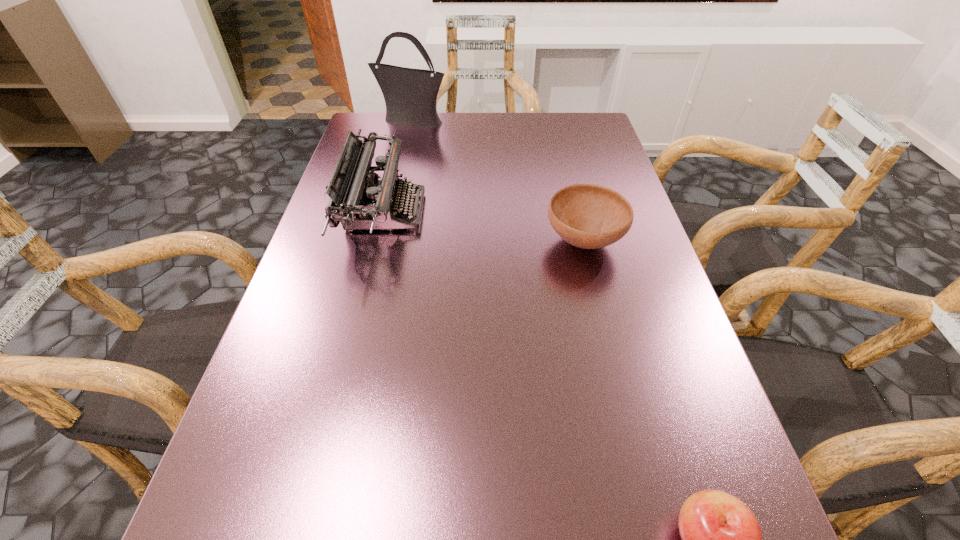
Locate an element on the screen. The width and height of the screenshot is (960, 540). object that is at the right edge is located at coordinates (588, 216).

The height and width of the screenshot is (540, 960). Identify the location of object that is at the far left corner. (410, 95).

The width and height of the screenshot is (960, 540). What are the coordinates of `vacant space at the far edge of the desktop` in the screenshot? It's located at (445, 118).

Find the location of a particular element. The height and width of the screenshot is (540, 960). vacant area at the left edge of the desktop is located at coordinates pos(277,340).

Find the location of a particular element. free space at the right edge of the desktop is located at coordinates pos(663,393).

Locate an element on the screen. The height and width of the screenshot is (540, 960). vacant area at the far left corner is located at coordinates (380, 147).

The height and width of the screenshot is (540, 960). Find the location of `free space between the second tallest object and the tallest object`. free space between the second tallest object and the tallest object is located at coordinates (398, 166).

What are the coordinates of `free area in between the bowl and the typewriter` in the screenshot? It's located at (485, 226).

Identify the location of free space that is in between the shoulder bag and the third shortest object. (398, 166).

At what (x,y) coordinates should I click in order to perform the action: click on vacant space in between the second tallest object and the farthest object. Please return your answer as a coordinate pair (x, y). Image resolution: width=960 pixels, height=540 pixels. Looking at the image, I should click on (398, 166).